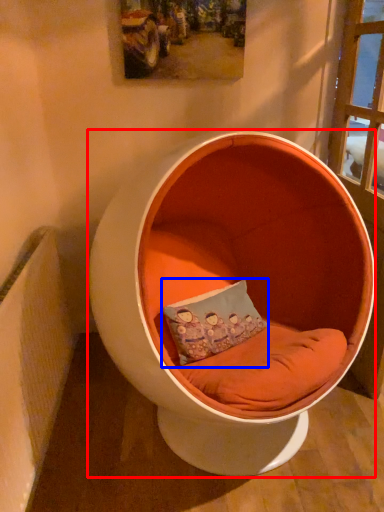
Question: Which object appears farthest to the camera in this image, furniture (highlighted by a red box) or pillow (highlighted by a blue box)?

Choices:
 (A) furniture
 (B) pillow

Answer: (B)